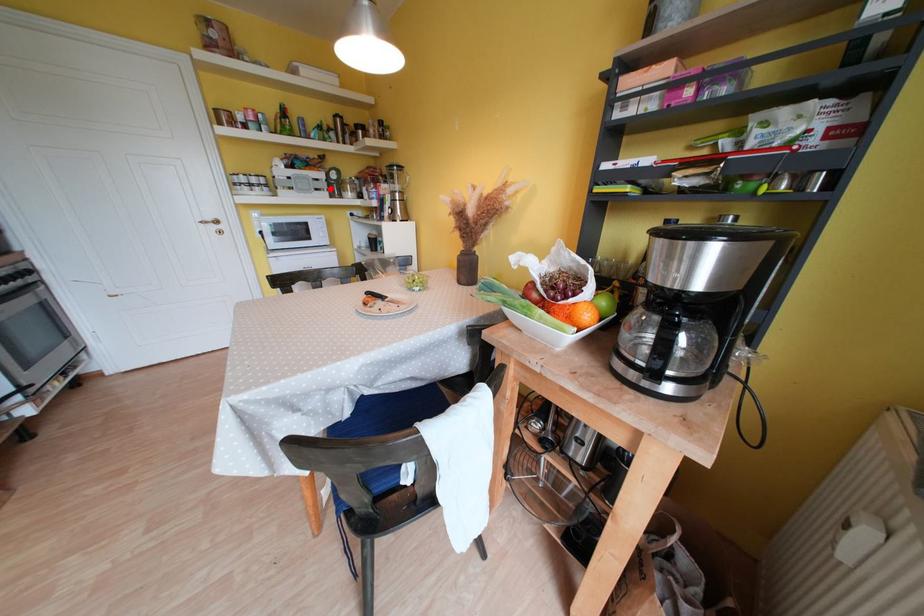
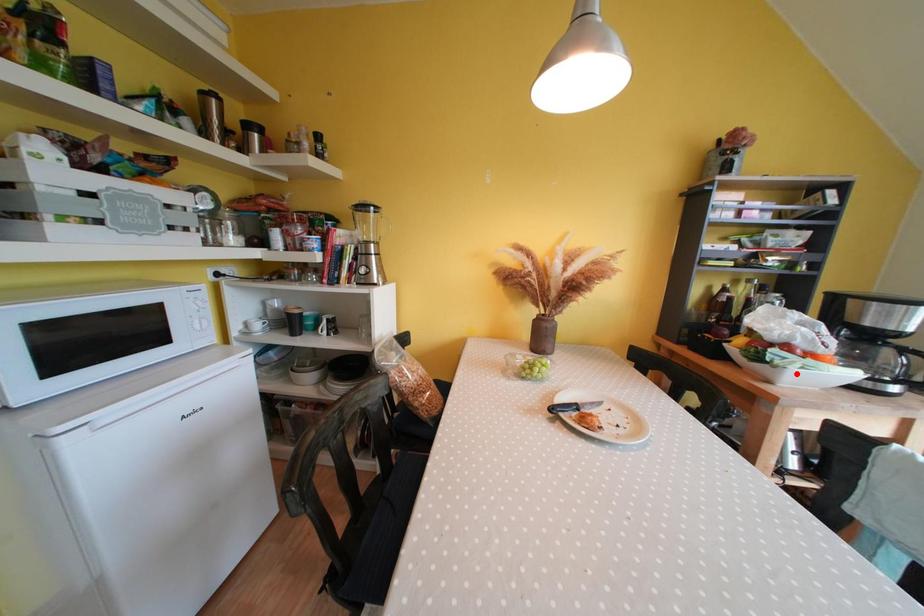
In the scene shown: I am providing you with two images of the same scene from different viewpoints. A red point is marked on the first image and another point is marked on the second image. Are the points marked in image1 and image2 representing the same 3D position?

No